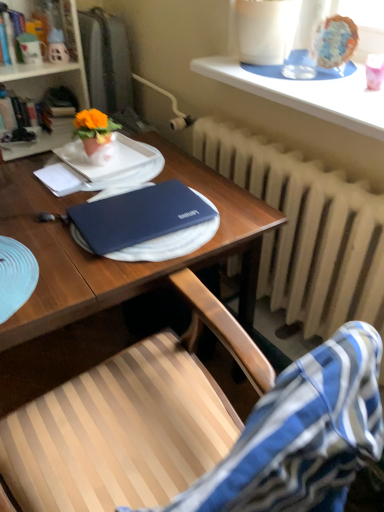
Identify the location of free space to the left of blue matte laptop at center. (37, 228).